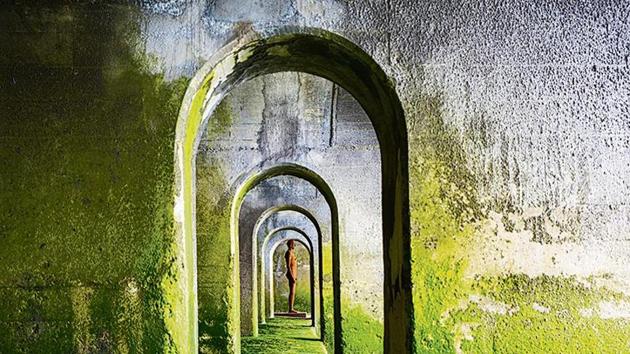
The height and width of the screenshot is (354, 630). In order to click on multiple archways in this screenshot , I will do `click(375, 68)`, `click(328, 205)`, `click(314, 234)`, `click(315, 249)`, `click(304, 250)`.